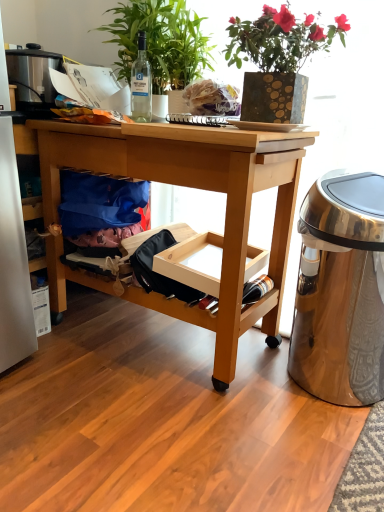
Locate an element on the screen. The width and height of the screenshot is (384, 512). free space underneath polished metallic trash can at right (from a real-world perspective) is located at coordinates (314, 386).